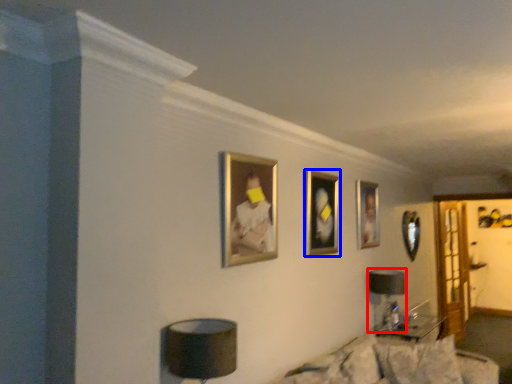
Question: Which point is closer to the camera, table lamp (highlighted by a red box) or picture frame (highlighted by a blue box)?

Choices:
 (A) table lamp
 (B) picture frame

Answer: (B)